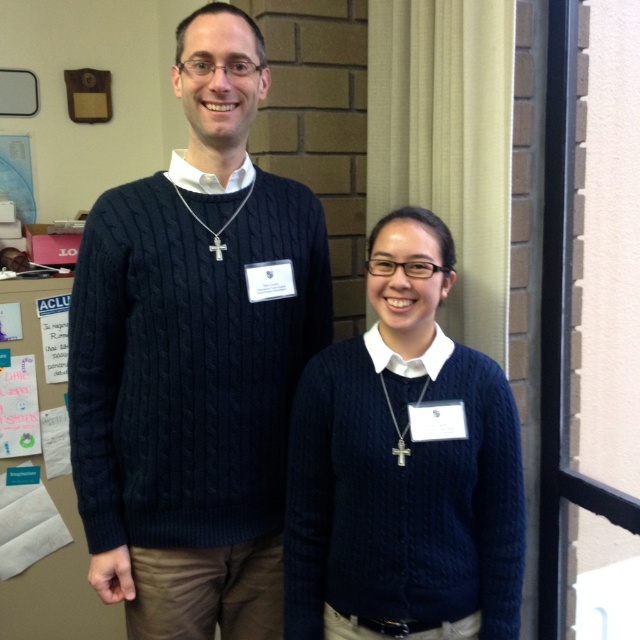
Which is in front, point (115, 492) or point (403, 538)?

Point (403, 538) is more forward.

Who is positioned more to the left, cable-knit sweater at center or cable-knit navy sweater at center?

Positioned to the left is cable-knit sweater at center.

Is point (253, 246) closer to camera compared to point (422, 589)?

No, it is behind (422, 589).

This screenshot has height=640, width=640. Identify the location of cable-knit sweater at center. (195, 358).